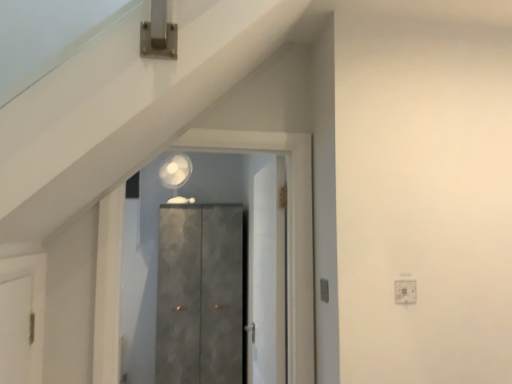
Question: Does white matte door at center, which ranks as the 2th door in back-to-front order, come in front of matte gray cabinet at center, which appears as the 1th door when viewed from the front?

Choices:
 (A) no
 (B) yes

Answer: (A)

Question: Is white matte door at center, placed as the 2th door when sorted from front to back, positioned with its back to matte gray cabinet at center, which appears as the 3th door when viewed from the back?

Choices:
 (A) yes
 (B) no

Answer: (B)

Question: Considering the relative sizes of white matte door at center, placed as the 2th door when sorted from front to back, and matte gray cabinet at center, which appears as the 1th door when viewed from the front, in the image provided, is white matte door at center, placed as the 2th door when sorted from front to back, smaller than matte gray cabinet at center, which appears as the 1th door when viewed from the front,?

Choices:
 (A) yes
 (B) no

Answer: (B)

Question: Is white matte door at center, which ranks as the 2th door in back-to-front order, thinner than matte gray cabinet at center, which appears as the 3th door when viewed from the back?

Choices:
 (A) no
 (B) yes

Answer: (B)

Question: Can you confirm if white matte door at center, placed as the 2th door when sorted from front to back, is wider than matte gray cabinet at center, which appears as the 1th door when viewed from the front?

Choices:
 (A) yes
 (B) no

Answer: (B)

Question: Visually, is white matte door at center, placed as the 2th door when sorted from front to back, positioned to the left or to the right of matte gray cabinet at center, which appears as the 1th door when viewed from the front?

Choices:
 (A) left
 (B) right

Answer: (B)

Question: From the image's perspective, relative to matte gray cabinet at center, which appears as the 1th door when viewed from the front, is white matte door at center, placed as the 2th door when sorted from front to back, above or below?

Choices:
 (A) below
 (B) above

Answer: (A)

Question: Considering their positions, is white matte door at center, which ranks as the 2th door in back-to-front order, located in front of or behind matte gray cabinet at center, which appears as the 1th door when viewed from the front?

Choices:
 (A) front
 (B) behind

Answer: (B)

Question: Considering the positions of white matte door at center, placed as the 2th door when sorted from front to back, and matte gray cabinet at center, which appears as the 1th door when viewed from the front, in the image, is white matte door at center, placed as the 2th door when sorted from front to back, wider or thinner than matte gray cabinet at center, which appears as the 1th door when viewed from the front,?

Choices:
 (A) thin
 (B) wide

Answer: (A)

Question: Considering their positions, is white matte door at center, placed as the 2th door when sorted from front to back, located in front of or behind matte gray cabinet at center, the third door from the front?

Choices:
 (A) front
 (B) behind

Answer: (A)

Question: Choose the correct answer: Is white matte door at center, placed as the 2th door when sorted from front to back, inside matte gray cabinet at center, which appears as the 1th door when viewed from the back, or outside it?

Choices:
 (A) inside
 (B) outside

Answer: (B)

Question: In terms of width, does white matte door at center, which ranks as the 2th door in back-to-front order, look wider or thinner when compared to matte gray cabinet at center, which appears as the 1th door when viewed from the back?

Choices:
 (A) wide
 (B) thin

Answer: (B)

Question: Is point (271, 261) positioned closer to the camera than point (221, 365)?

Choices:
 (A) closer
 (B) farther

Answer: (A)

Question: From their relative heights in the image, would you say matte gray cabinet at center, the third door from the front, is taller or shorter than matte gray cabinet at center, which appears as the 1th door when viewed from the front?

Choices:
 (A) tall
 (B) short

Answer: (A)

Question: Is matte gray cabinet at center, the third door from the front, situated inside matte gray cabinet at center, which appears as the 3th door when viewed from the back, or outside?

Choices:
 (A) outside
 (B) inside

Answer: (A)